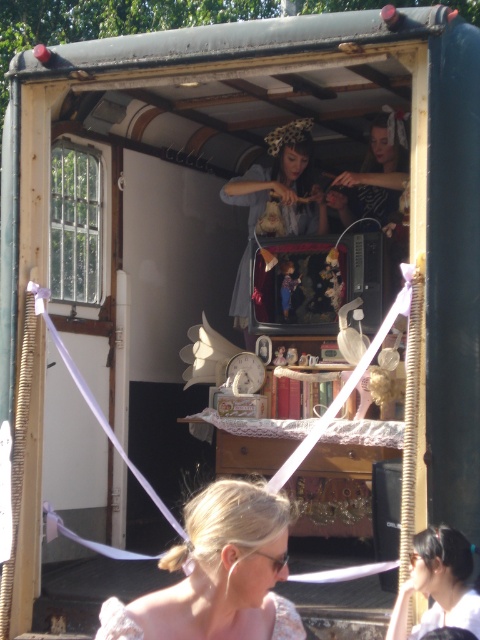
Question: Does blonde hair at center have a greater width compared to matte gray dress at center?

Choices:
 (A) yes
 (B) no

Answer: (A)

Question: Which point is farther to the camera?

Choices:
 (A) blonde hair at center
 (B) matte gray dress at center

Answer: (B)

Question: Which object appears farthest from the camera in this image?

Choices:
 (A) blonde hair at center
 (B) matte gray dress at center

Answer: (B)

Question: Can you confirm if blonde hair at center is thinner than matte gray dress at center?

Choices:
 (A) no
 (B) yes

Answer: (A)

Question: Is blonde hair at center above matte gray dress at center?

Choices:
 (A) no
 (B) yes

Answer: (A)